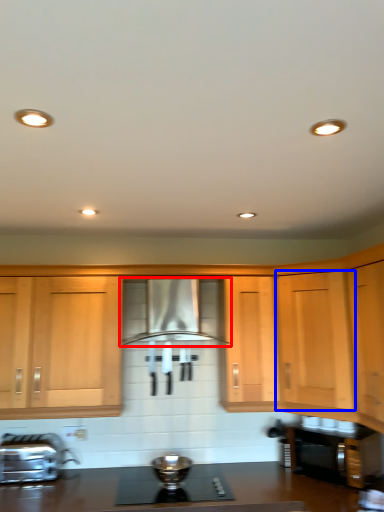
Question: Which point is further to the camera, home appliance (highlighted by a red box) or cabinetry (highlighted by a blue box)?

Choices:
 (A) home appliance
 (B) cabinetry

Answer: (A)